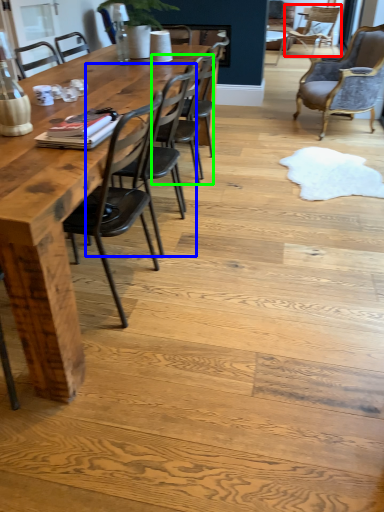
Question: Which object is the farthest from chair (highlighted by a red box)? Choose among these: chair (highlighted by a blue box) or chair (highlighted by a green box).

Choices:
 (A) chair
 (B) chair

Answer: (A)